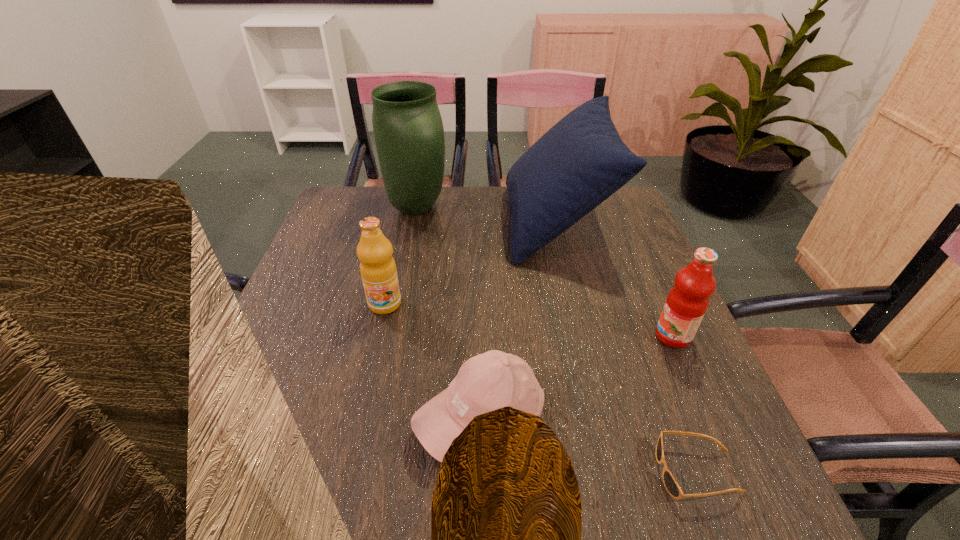
Find the location of `vacant space located on the facing side of the cushion`. vacant space located on the facing side of the cushion is located at coordinates (473, 222).

At what (x,y) coordinates should I click in order to perform the action: click on blank space located 0.250m on the facing side of the cushion. Please return your answer as a coordinate pair (x, y). Looking at the image, I should click on tap(422, 222).

Where is `vacant area situated on the front label of the left fruit juice`? vacant area situated on the front label of the left fruit juice is located at coordinates (374, 350).

You are a GUI agent. You are given a task and a screenshot of the screen. Output one action in this format:
    pyautogui.click(x=<x>, y=<y>)
    Task: Click on the free spot located 0.220m on the front label of the nearer fruit juice
    The image size is (960, 540).
    Given the screenshot: What is the action you would take?
    pyautogui.click(x=555, y=336)

Image resolution: width=960 pixels, height=540 pixels. Find the location of `vacant area situated on the front label of the nearer fruit juice`. vacant area situated on the front label of the nearer fruit juice is located at coordinates (505, 336).

This screenshot has width=960, height=540. I want to click on vacant space located on the front label of the nearer fruit juice, so click(491, 336).

Where is `free space located on the front-facing side of the sunglasses`? free space located on the front-facing side of the sunglasses is located at coordinates (474, 472).

Locate an element on the screen. vacant space positioned 0.210m on the front-facing side of the sunglasses is located at coordinates [x=534, y=472].

You are a GUI agent. You are given a task and a screenshot of the screen. Output one action in this format:
    pyautogui.click(x=<x>, y=<y>)
    Task: Click on the free region located 0.060m on the front-facing side of the sunglasses
    
    Given the screenshot: What is the action you would take?
    pyautogui.click(x=623, y=472)

Where is `vase that is positioned at the far edge`? The height and width of the screenshot is (540, 960). vase that is positioned at the far edge is located at coordinates (408, 129).